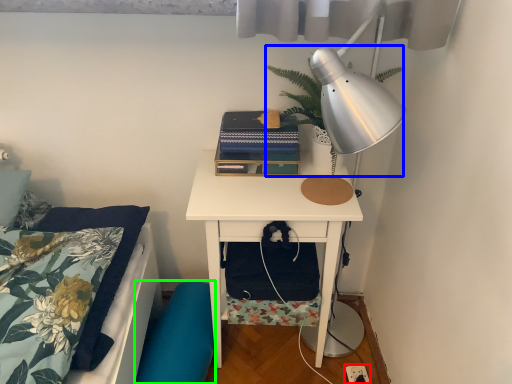
Question: Based on their relative distances, which object is farther from electric outlet (highlighted by a red box)? Choose from plant (highlighted by a blue box) and swivel chair (highlighted by a green box).

Choices:
 (A) plant
 (B) swivel chair

Answer: (A)